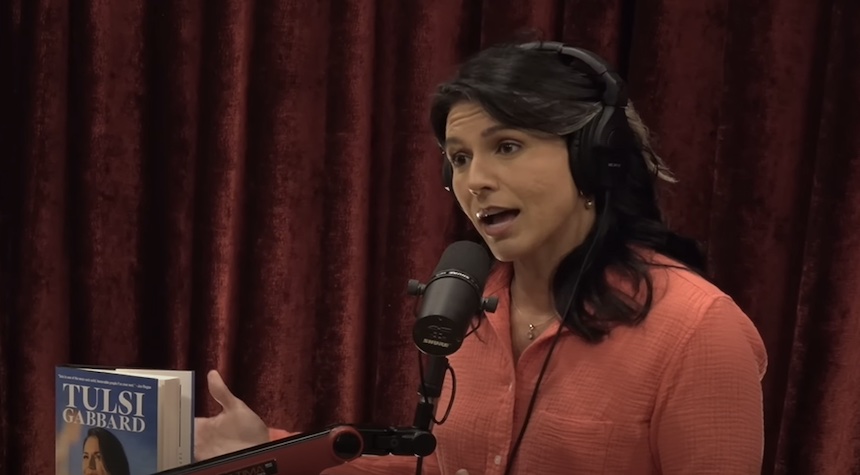
Identify the location of cable. (541, 374).